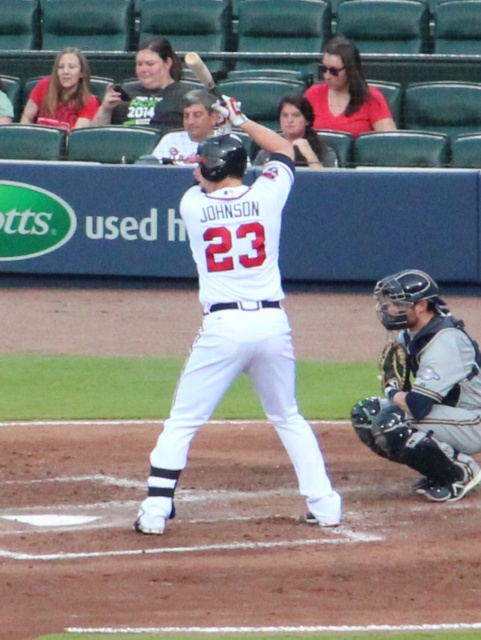
You are a photographer trying to capture a closeup of the white matte uniform at center and the leather textured glove at lower right. Since you can only focus on one object at a time, which one should you focus on to ensure the other is still in the background?

The white matte uniform at center is in front of the leather textured glove at lower right, so you should focus on the white matte uniform at center to keep the leather textured glove at lower right in the background.

You are a photographer at the baseball game and want to take a closeup shot of the batter. You have two points marked on your camera screen to focus on. The first point is at point (367, 426) and the second is at point (213, 77). Which point should you choose to focus on to capture the batter clearly?

Point (367, 426) is closer to the viewer than point (213, 77), so you should focus on point (367, 426) to capture the batter clearly.